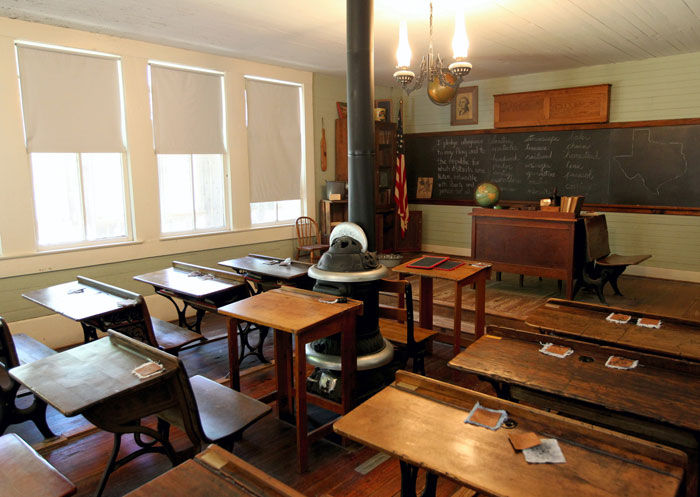
Identify every occurrence of where you'd sit in the image. Your answer should be formatted as a list of tuples, i.e. [(x1, y1), (x2, y2), ...], where each tuple contains the x and y coordinates of a point satisfying the conditions above.

[(215, 405)]